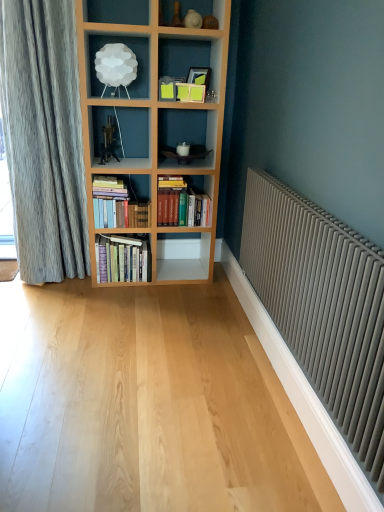
Locate an element on the screen. This screenshot has width=384, height=512. vacant area that is situated to the right of hardcover books at center, the third book positioned from the right is located at coordinates (164, 285).